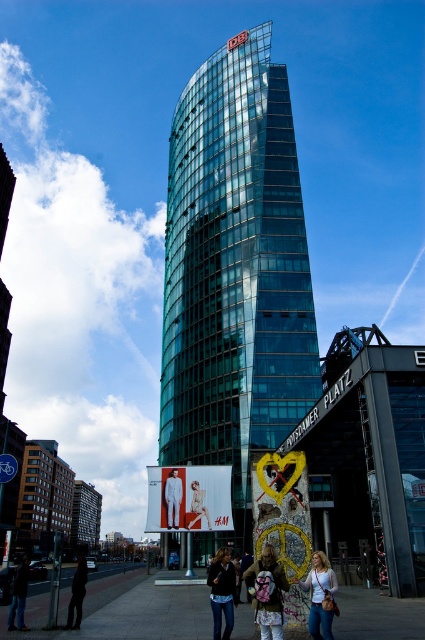
You are a photographer standing at the base of the curved glass skyscraper and want to take a photo that includes both the dark blue jeans at lower left and the white fabric person at center. Which object should you focus on first to ensure both are in frame?

You should focus on the dark blue jeans at lower left first since it is taller than the white fabric person at center, ensuring it fits within the frame while capturing both objects.

You are a drone operator trying to navigate between two points in the image. You need to fly from point A to point B. Given that point A is at coordinates point (x=371, y=602) and point B is at coordinates point (x=226, y=632), which point is closer to the Berlin Wall section located on the right side of the image?

Result: Point B at coordinates point (x=226, y=632) is closer to the Berlin Wall section on the right side of the image because it is positioned in front of point A, which is behind point B.

You are a photographer standing in front of the curved glass skyscraper. You notice two white clothing items in the scene. Which one is closer to you, the white cotton shirt at lower center or the white fabric pants at center?

The white cotton shirt at lower center is closer to the viewer than the white fabric pants at center.